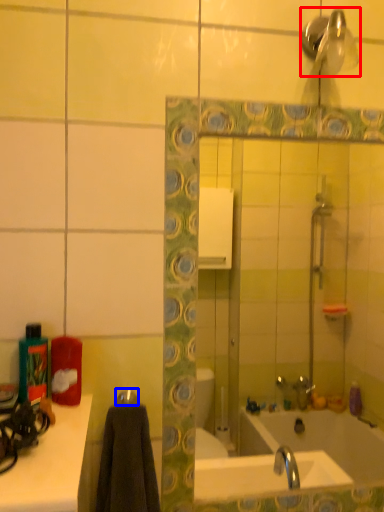
Question: Among these objects, which one is nearest to the camera, shower (highlighted by a red box) or towel bar (highlighted by a blue box)?

Choices:
 (A) shower
 (B) towel bar

Answer: (A)